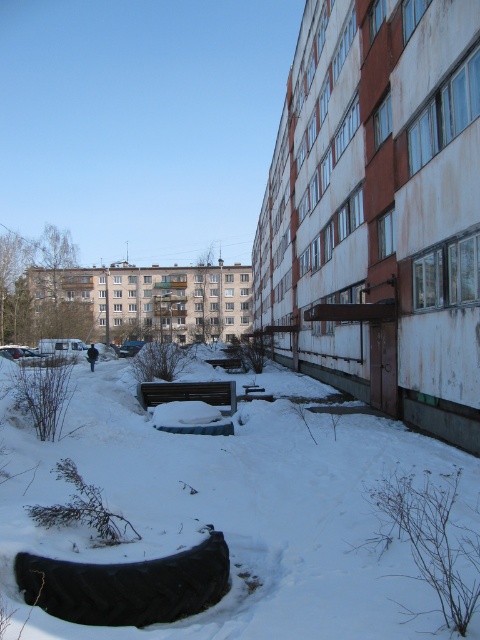
You are standing at point A and want to walk to the wooden bench near the center. The path goes through point B, which is at point (231, 508). What is the condition of the ground at point B?

The ground at point B is covered with white fluffy snow at center.

You are a city planner assessing the snow removal needs for the area. Given the white fluffy snow at center and the black rubber tire at lower left, which object requires more immediate attention for snow removal based on their height?

The white fluffy snow at center requires more immediate attention for snow removal since it has a greater height compared to the black rubber tire at lower left, as stated in the description.